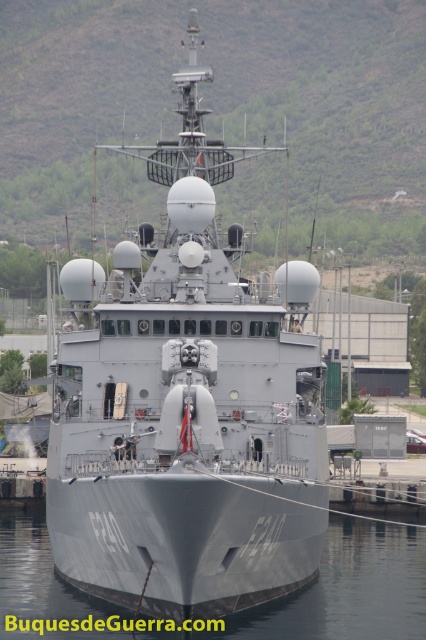
Can you confirm if gray metallic ship at center is bigger than gray metallic water at center?

Yes, gray metallic ship at center is bigger than gray metallic water at center.

Describe the element at coordinates (187, 406) in the screenshot. I see `gray metallic ship at center` at that location.

This screenshot has height=640, width=426. I want to click on gray metallic ship at center, so click(187, 406).